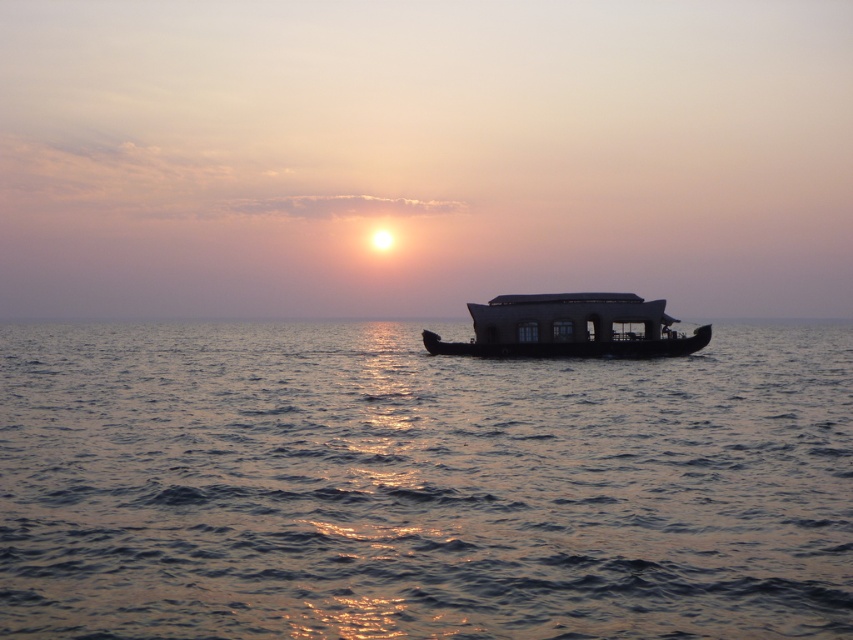
You are standing on the shore of the sunset scene and want to locate the blue water at center. According to the coordinates provided, where would you look relative to your position?

You should look towards the center of the scene at coordinates point (x=419, y=484) to find the blue water at center.

You are standing at the point closest to the camera in the sunset scene. Which point, point [643,499] or point [531,321], are you currently at?

You are at point [643,499] because it is closer to the camera than point [531,321].